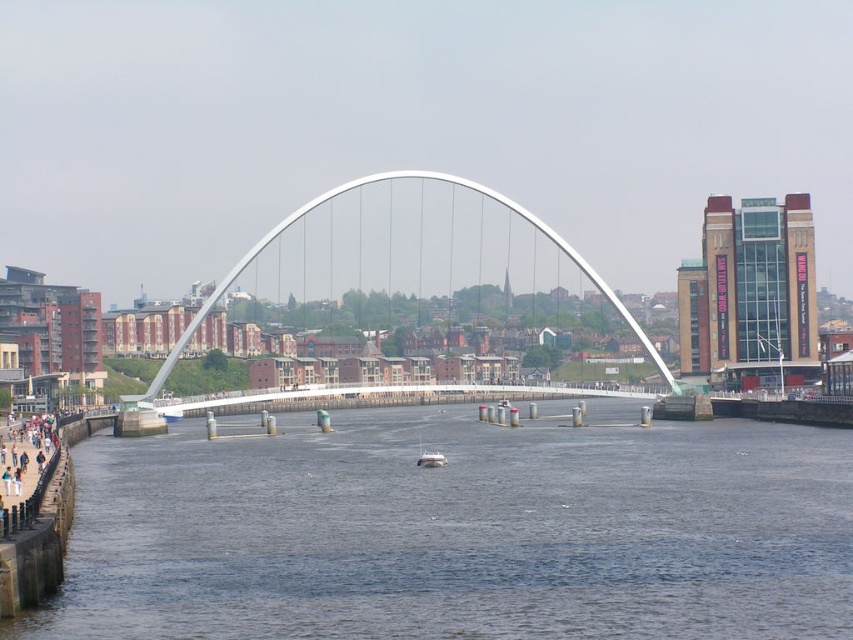
Who is shorter, dark blue water at center or white metallic arch bridge at center?

Standing shorter between the two is dark blue water at center.

Is dark blue water at center shorter than white metallic arch bridge at center?

Indeed, dark blue water at center has a lesser height compared to white metallic arch bridge at center.

Is point (206, 531) in front of point (303, 209)?

Yes, point (206, 531) is closer to viewer.

Locate an element on the screen. dark blue water at center is located at coordinates (459, 531).